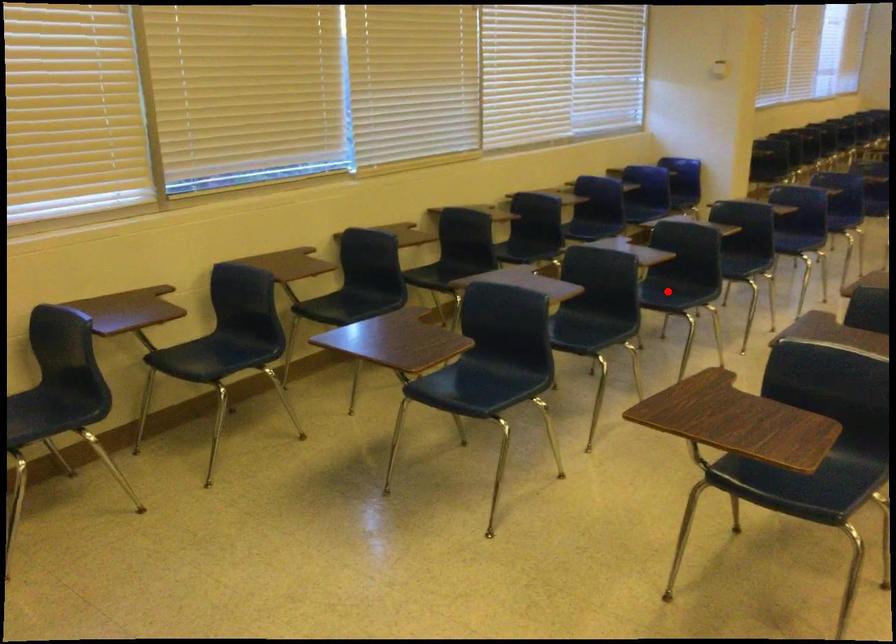
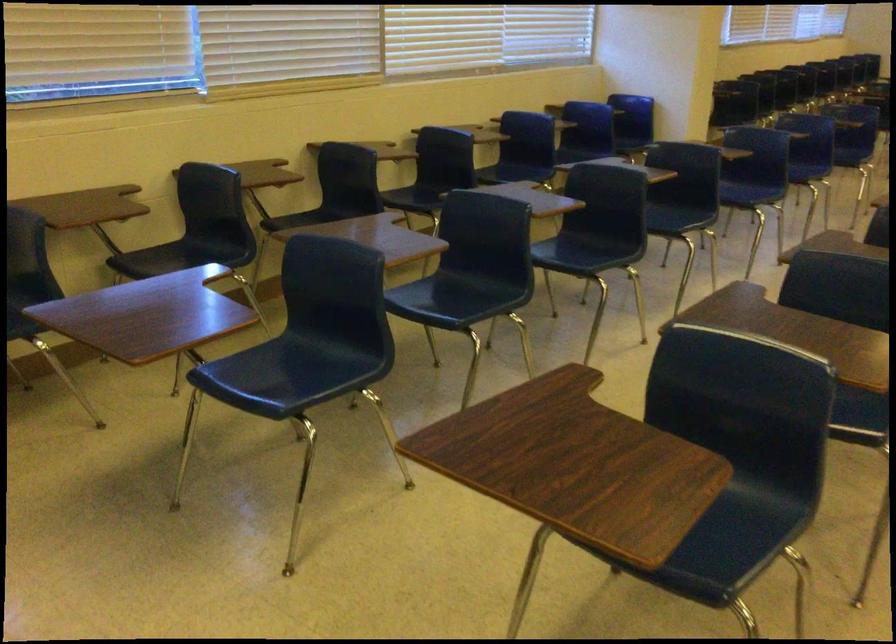
Where in the second image is the point corresponding to the highlighted location from the first image?

(586, 252)